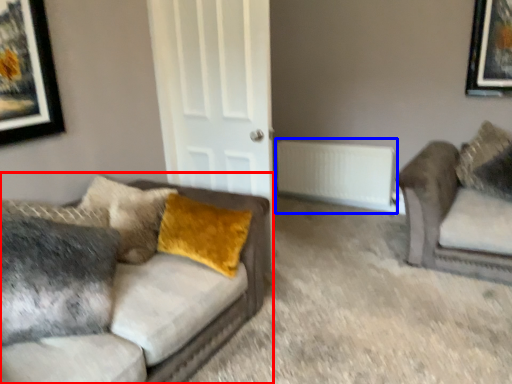
Question: Which point is further to the camera, studio couch (highlighted by a red box) or radiator (highlighted by a blue box)?

Choices:
 (A) studio couch
 (B) radiator

Answer: (B)